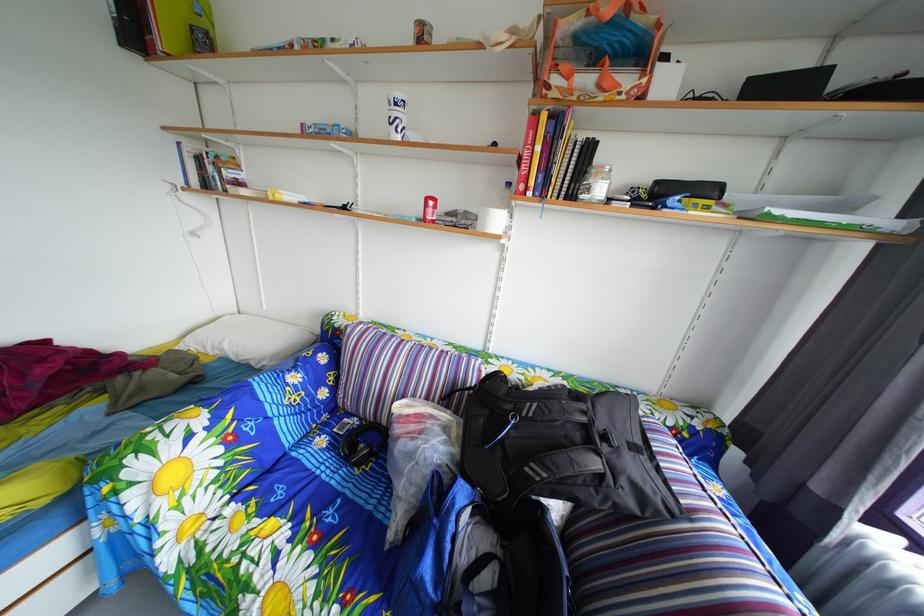
What are the coordinates of `red plastic bottle` in the screenshot? It's located at [x=430, y=209].